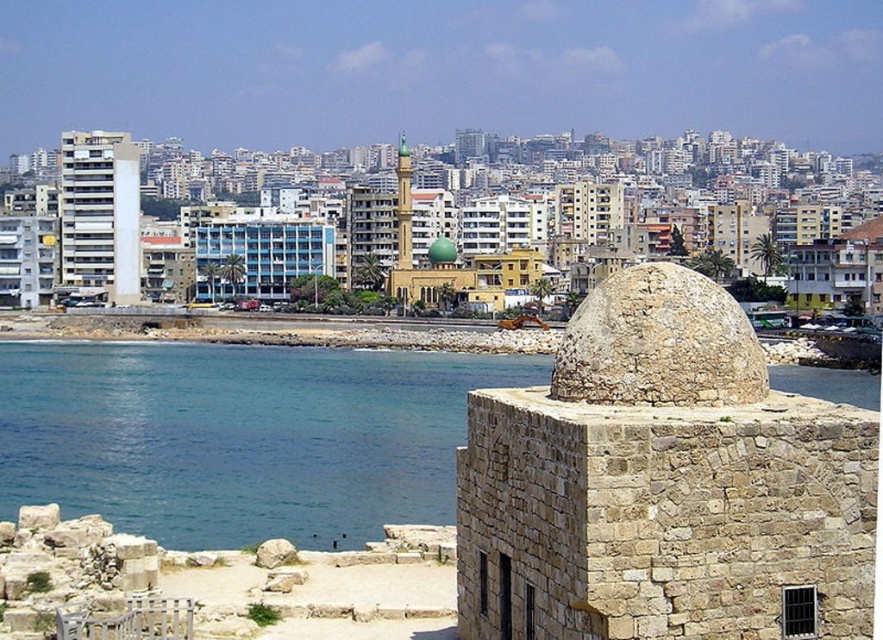
Between point (368, 412) and point (130, 168), which one is positioned behind?

The point (130, 168) is behind.

Is blue water at lower left wider than white smooth building at left?

Yes, blue water at lower left is wider than white smooth building at left.

Is point (300, 390) closer to viewer compared to point (134, 164)?

Yes, point (300, 390) is closer to viewer.

Locate an element on the screen. This screenshot has height=640, width=883. blue water at lower left is located at coordinates (239, 436).

Does blue water at lower left have a lesser height compared to smooth gray rock at lower left?

In fact, blue water at lower left may be taller than smooth gray rock at lower left.

Who is higher up, blue water at lower left or smooth gray rock at lower left?

blue water at lower left is above.

Who is more forward, (100, 428) or (260, 557)?

Positioned in front is point (260, 557).

Image resolution: width=883 pixels, height=640 pixels. I want to click on blue water at lower left, so click(239, 436).

Who is positioned more to the right, brown stone dome at center or blue water at lower left?

brown stone dome at center is more to the right.

Does brown stone dome at center lie behind blue water at lower left?

No, it is not.

Is point (472, 420) in front of point (145, 397)?

Yes.

The image size is (883, 640). I want to click on brown stone dome at center, so click(663, 484).